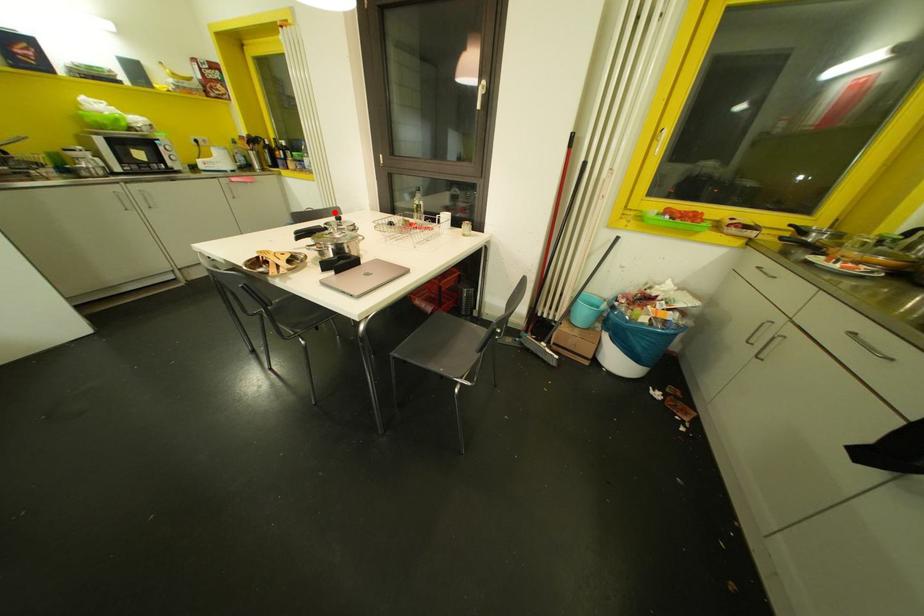
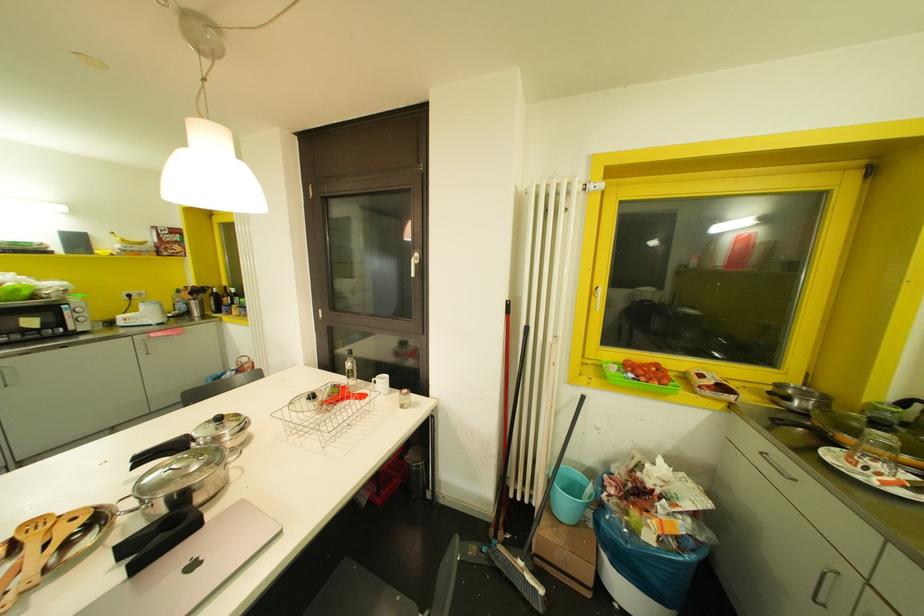
Question: I am providing you with two images of the same scene from different viewpoints. A red point is marked on the first image. Is the red point's position out of view in image 2?

Choices:
 (A) Yes
 (B) No

Answer: (A)